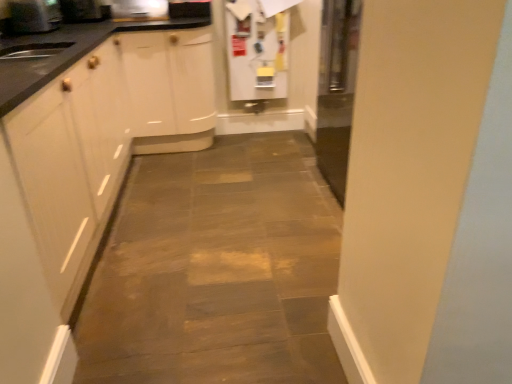
Question: Does metallic silver toaster at upper left, acting as the fourth appliance starting from the right, contain metallic stainless steel microwave at upper left, acting as the 3th appliance starting from the right?

Choices:
 (A) yes
 (B) no

Answer: (B)

Question: Can you confirm if metallic silver toaster at upper left, acting as the fourth appliance starting from the right, is shorter than metallic stainless steel microwave at upper left, acting as the 3th appliance starting from the right?

Choices:
 (A) yes
 (B) no

Answer: (B)

Question: From the image's perspective, is metallic silver toaster at upper left, arranged as the first appliance when viewed from the left, above metallic stainless steel microwave at upper left, marked as the second appliance in a left-to-right arrangement?

Choices:
 (A) no
 (B) yes

Answer: (A)

Question: Is metallic silver toaster at upper left, arranged as the first appliance when viewed from the left, next to metallic stainless steel microwave at upper left, acting as the 3th appliance starting from the right?

Choices:
 (A) no
 (B) yes

Answer: (A)

Question: Is metallic stainless steel microwave at upper left, acting as the 3th appliance starting from the right, at the back of metallic silver toaster at upper left, arranged as the first appliance when viewed from the left?

Choices:
 (A) yes
 (B) no

Answer: (B)

Question: Considering their positions, is white matte refrigerator at upper center, marked as the 4th appliance in a left-to-right arrangement, located in front of or behind metallic silver toaster at upper left, arranged as the first appliance when viewed from the left?

Choices:
 (A) behind
 (B) front

Answer: (A)

Question: From a real-world perspective, is white matte refrigerator at upper center, marked as the 4th appliance in a left-to-right arrangement, positioned above or below metallic silver toaster at upper left, acting as the fourth appliance starting from the right?

Choices:
 (A) below
 (B) above

Answer: (A)

Question: Based on their sizes in the image, would you say white matte refrigerator at upper center, the 1th appliance viewed from the right, is bigger or smaller than metallic silver toaster at upper left, arranged as the first appliance when viewed from the left?

Choices:
 (A) big
 (B) small

Answer: (A)

Question: Considering the positions of point (282, 44) and point (36, 14), is point (282, 44) closer or farther from the camera than point (36, 14)?

Choices:
 (A) closer
 (B) farther

Answer: (B)

Question: From the image's perspective, is metallic stainless steel microwave at upper center, which appears as the 3th appliance when viewed from the left, located above or below metallic stainless steel microwave at upper left, marked as the second appliance in a left-to-right arrangement?

Choices:
 (A) above
 (B) below

Answer: (B)

Question: Considering the positions of metallic stainless steel microwave at upper center, the 2th appliance positioned from the right, and metallic stainless steel microwave at upper left, acting as the 3th appliance starting from the right, in the image, is metallic stainless steel microwave at upper center, the 2th appliance positioned from the right, taller or shorter than metallic stainless steel microwave at upper left, acting as the 3th appliance starting from the right,?

Choices:
 (A) short
 (B) tall

Answer: (B)

Question: Is metallic stainless steel microwave at upper center, which appears as the 3th appliance when viewed from the left, situated inside metallic stainless steel microwave at upper left, marked as the second appliance in a left-to-right arrangement, or outside?

Choices:
 (A) outside
 (B) inside

Answer: (A)

Question: Considering their positions, is metallic stainless steel microwave at upper center, which appears as the 3th appliance when viewed from the left, located in front of or behind metallic stainless steel microwave at upper left, acting as the 3th appliance starting from the right?

Choices:
 (A) front
 (B) behind

Answer: (B)

Question: In terms of width, does metallic stainless steel microwave at upper center, the 2th appliance positioned from the right, look wider or thinner when compared to white matte refrigerator at upper center, marked as the 4th appliance in a left-to-right arrangement?

Choices:
 (A) thin
 (B) wide

Answer: (B)

Question: From a real-world perspective, is metallic stainless steel microwave at upper center, the 2th appliance positioned from the right, above or below white matte refrigerator at upper center, the 1th appliance viewed from the right?

Choices:
 (A) above
 (B) below

Answer: (A)